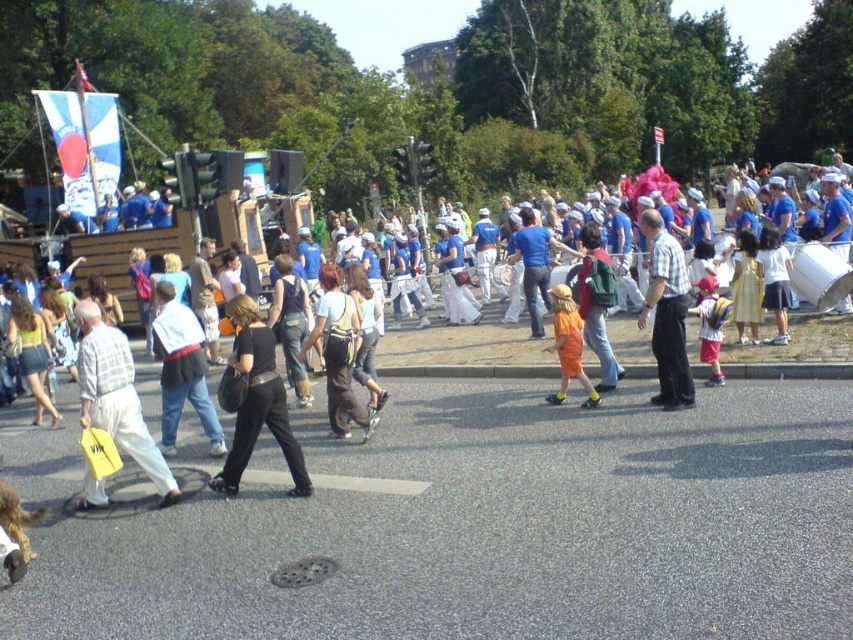
You are standing at the point marked as point [114,378] in the image. If you walk straight ahead, will you immediately encounter the paved road where the pedestrians are walking?

The distance of point [114,378] from viewer is 25.05 feet, so if you walk straight ahead from point [114,378], you will have to cover 25.05 feet to reach the paved road where the pedestrians are walking. Whether you immediately encounter it depends on the direction you are facing, but based on the given distance, it is 25.05 feet away.

You are a photographer trying to capture a person wearing a light gray plaid shirt at center and denim pants at center. Which part of the person should you focus on to ensure both items are in the frame?

A: The light gray plaid shirt at center is positioned on the left side of denim pants at center, so focusing on the left side of the person will ensure both items are in the frame.